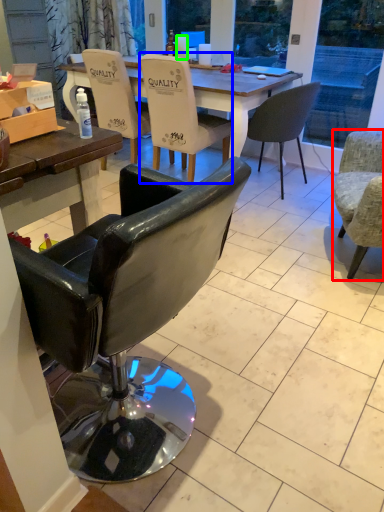
Question: Based on their relative distances, which object is nearer to chair (highlighted by a red box)? Choose from chair (highlighted by a blue box) and coffee cup (highlighted by a green box).

Choices:
 (A) chair
 (B) coffee cup

Answer: (A)